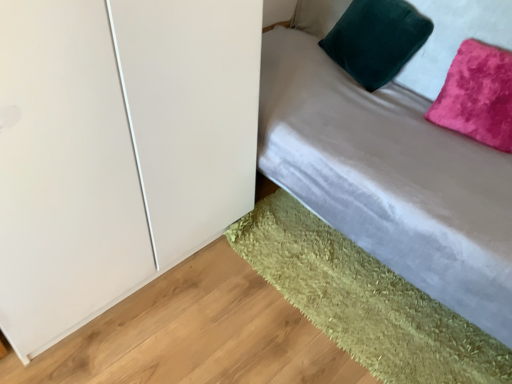
What do you see at coordinates (364, 300) in the screenshot?
I see `green shaggy rug at lower right` at bounding box center [364, 300].

In order to click on green shaggy rug at lower right in this screenshot , I will do `click(364, 300)`.

This screenshot has width=512, height=384. What do you see at coordinates (388, 173) in the screenshot? I see `velvet gray bed at upper right` at bounding box center [388, 173].

In the scene shown: In order to face pink velvet pillow at upper right, positioned as the 2th pillow in left-to-right order, should I rotate leftwards or rightwards?

Rotate right and turn 28.627 degrees.

Locate an element on the screen. green shaggy rug at lower right is located at coordinates (364, 300).

Between pink velvet pillow at upper right, positioned as the 2th pillow in left-to-right order, and velvet gray bed at upper right, which one has larger size?

With larger size is velvet gray bed at upper right.

Can you confirm if pink velvet pillow at upper right, positioned as the 2th pillow in left-to-right order, is positioned to the left of velvet gray bed at upper right?

No.

From the image's perspective, is pink velvet pillow at upper right, which is counted as the first pillow, starting from the right, positioned above or below velvet gray bed at upper right?

From the image's perspective, pink velvet pillow at upper right, which is counted as the first pillow, starting from the right, appears below velvet gray bed at upper right.

Is pink velvet pillow at upper right, which is counted as the first pillow, starting from the right, outside of velvet gray bed at upper right?

No, pink velvet pillow at upper right, which is counted as the first pillow, starting from the right, is inside velvet gray bed at upper right's boundary.

Is velvet green pillow at upper right, the 1th pillow viewed from the left, positioned before velvet gray bed at upper right?

No, it is not.

Does velvet green pillow at upper right, the 2th pillow when ordered from right to left, turn towards velvet gray bed at upper right?

Yes, velvet green pillow at upper right, the 2th pillow when ordered from right to left, is oriented towards velvet gray bed at upper right.

From a real-world perspective, which object stands above the other?

velvet green pillow at upper right, the 1th pillow viewed from the left, is physically above.

Between velvet green pillow at upper right, the 1th pillow viewed from the left, and velvet gray bed at upper right, which one has smaller size?

With smaller size is velvet green pillow at upper right, the 1th pillow viewed from the left.

Visually, is green shaggy rug at lower right positioned to the left or to the right of velvet gray bed at upper right?

In the image, green shaggy rug at lower right appears on the left side of velvet gray bed at upper right.

Which of these two, green shaggy rug at lower right or velvet gray bed at upper right, is wider?

Wider between the two is velvet gray bed at upper right.

What's the angular difference between green shaggy rug at lower right and velvet gray bed at upper right's facing directions?

0.266 degrees.

From the image's perspective, relative to velvet gray bed at upper right, is green shaggy rug at lower right above or below?

Clearly, from the image's perspective, green shaggy rug at lower right is below velvet gray bed at upper right.

Does green shaggy rug at lower right have a larger size compared to velvet green pillow at upper right, the 1th pillow viewed from the left?

No, green shaggy rug at lower right is not bigger than velvet green pillow at upper right, the 1th pillow viewed from the left.

From the image's perspective, is green shaggy rug at lower right over velvet green pillow at upper right, the 1th pillow viewed from the left?

Incorrect, from the image's perspective, green shaggy rug at lower right is lower than velvet green pillow at upper right, the 1th pillow viewed from the left.

Image resolution: width=512 pixels, height=384 pixels. What are the coordinates of `pillow that is the 2nd object above the green shaggy rug at lower right (from a real-world perspective)` in the screenshot? It's located at tap(376, 39).

Is green shaggy rug at lower right taller or shorter than velvet green pillow at upper right, the 2th pillow when ordered from right to left?

Considering their sizes, green shaggy rug at lower right has less height than velvet green pillow at upper right, the 2th pillow when ordered from right to left.

Is point (505, 136) closer to camera compared to point (357, 311)?

No, it is behind (357, 311).

Considering the relative sizes of pink velvet pillow at upper right, which is counted as the first pillow, starting from the right, and green shaggy rug at lower right in the image provided, is pink velvet pillow at upper right, which is counted as the first pillow, starting from the right, wider than green shaggy rug at lower right?

Incorrect, the width of pink velvet pillow at upper right, which is counted as the first pillow, starting from the right, does not surpass that of green shaggy rug at lower right.

Between pink velvet pillow at upper right, positioned as the 2th pillow in left-to-right order, and green shaggy rug at lower right, which one is positioned in front?

green shaggy rug at lower right is in front.

Is pink velvet pillow at upper right, which is counted as the first pillow, starting from the right, taller than green shaggy rug at lower right?

Indeed, pink velvet pillow at upper right, which is counted as the first pillow, starting from the right, has a greater height compared to green shaggy rug at lower right.

How different are the orientations of green shaggy rug at lower right and pink velvet pillow at upper right, positioned as the 2th pillow in left-to-right order, in degrees?

They differ by 2.45 degrees in their facing directions.

How far apart are green shaggy rug at lower right and pink velvet pillow at upper right, positioned as the 2th pillow in left-to-right order?

green shaggy rug at lower right is 30.28 inches from pink velvet pillow at upper right, positioned as the 2th pillow in left-to-right order.

Is green shaggy rug at lower right aimed at pink velvet pillow at upper right, positioned as the 2th pillow in left-to-right order?

No, green shaggy rug at lower right is not facing towards pink velvet pillow at upper right, positioned as the 2th pillow in left-to-right order.

Are green shaggy rug at lower right and pink velvet pillow at upper right, positioned as the 2th pillow in left-to-right order, located far from each other?

No, green shaggy rug at lower right is in close proximity to pink velvet pillow at upper right, positioned as the 2th pillow in left-to-right order.

Considering the positions of point (353, 122) and point (497, 124), is point (353, 122) closer or farther from the camera than point (497, 124)?

Point (353, 122) appears to be farther away from the viewer than point (497, 124).

Considering the positions of objects velvet gray bed at upper right and pink velvet pillow at upper right, positioned as the 2th pillow in left-to-right order, in the image provided, who is more to the left, velvet gray bed at upper right or pink velvet pillow at upper right, positioned as the 2th pillow in left-to-right order,?

From the viewer's perspective, velvet gray bed at upper right appears more on the left side.

Who is taller, velvet gray bed at upper right or pink velvet pillow at upper right, positioned as the 2th pillow in left-to-right order?

Standing taller between the two is velvet gray bed at upper right.

Looking at this image, is velvet gray bed at upper right smaller than pink velvet pillow at upper right, positioned as the 2th pillow in left-to-right order?

No.

Identify the location of pillow on the right of the velvet gray bed at upper right. (477, 95).

This screenshot has height=384, width=512. Identify the location of the 2nd pillow behind the velvet gray bed at upper right, starting your count from the anchor. (376, 39).

Based on the photo, estimate the real-world distances between objects in this image. Which object is closer to velvet gray bed at upper right, green shaggy rug at lower right or velvet green pillow at upper right, the 2th pillow when ordered from right to left?

The object closer to velvet gray bed at upper right is velvet green pillow at upper right, the 2th pillow when ordered from right to left.

Which object lies nearer to the anchor point velvet gray bed at upper right, pink velvet pillow at upper right, which is counted as the first pillow, starting from the right, or velvet green pillow at upper right, the 1th pillow viewed from the left?

Based on the image, pink velvet pillow at upper right, which is counted as the first pillow, starting from the right, appears to be nearer to velvet gray bed at upper right.

Looking at this image, looking at the image, which one is located closer to pink velvet pillow at upper right, which is counted as the first pillow, starting from the right, velvet gray bed at upper right or velvet green pillow at upper right, the 2th pillow when ordered from right to left?

velvet gray bed at upper right lies closer to pink velvet pillow at upper right, which is counted as the first pillow, starting from the right, than the other object.

When comparing their distances from velvet gray bed at upper right, does velvet green pillow at upper right, the 2th pillow when ordered from right to left, or green shaggy rug at lower right seem further?

green shaggy rug at lower right.

Considering their positions, is green shaggy rug at lower right positioned closer to velvet green pillow at upper right, the 2th pillow when ordered from right to left, than pink velvet pillow at upper right, which is counted as the first pillow, starting from the right?

pink velvet pillow at upper right, which is counted as the first pillow, starting from the right, lies closer to velvet green pillow at upper right, the 2th pillow when ordered from right to left, than the other object.

From the image, which object appears to be nearer to velvet green pillow at upper right, the 2th pillow when ordered from right to left, pink velvet pillow at upper right, which is counted as the first pillow, starting from the right, or velvet gray bed at upper right?

Based on the image, velvet gray bed at upper right appears to be nearer to velvet green pillow at upper right, the 2th pillow when ordered from right to left.

Considering their positions, is green shaggy rug at lower right positioned further to velvet green pillow at upper right, the 2th pillow when ordered from right to left, than velvet gray bed at upper right?

Based on the image, green shaggy rug at lower right appears to be further to velvet green pillow at upper right, the 2th pillow when ordered from right to left.

Looking at this image, when comparing their distances from pink velvet pillow at upper right, which is counted as the first pillow, starting from the right, does velvet green pillow at upper right, the 1th pillow viewed from the left, or green shaggy rug at lower right seem further?

The object further to pink velvet pillow at upper right, which is counted as the first pillow, starting from the right, is green shaggy rug at lower right.

Where is `pillow between velvet green pillow at upper right, the 2th pillow when ordered from right to left, and green shaggy rug at lower right vertically`? pillow between velvet green pillow at upper right, the 2th pillow when ordered from right to left, and green shaggy rug at lower right vertically is located at coordinates (477, 95).

Find the location of a particular element. Image resolution: width=512 pixels, height=384 pixels. bed between velvet green pillow at upper right, the 2th pillow when ordered from right to left, and green shaggy rug at lower right, in the vertical direction is located at coordinates (388, 173).

I want to click on pillow located between velvet gray bed at upper right and velvet green pillow at upper right, the 2th pillow when ordered from right to left, in the depth direction, so click(x=477, y=95).

At what (x,y) coordinates should I click in order to perform the action: click on pillow between velvet gray bed at upper right and green shaggy rug at lower right vertically. Please return your answer as a coordinate pair (x, y). Looking at the image, I should click on (477, 95).